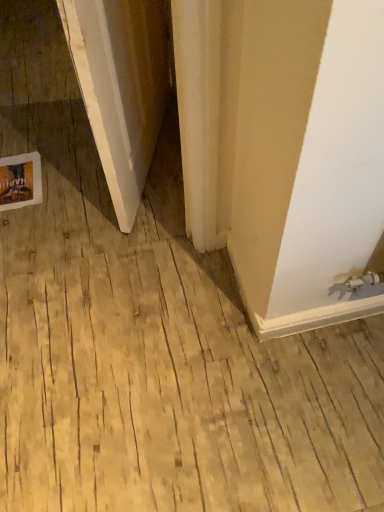
Question: Should I look upward or downward to see white cardboard postcard at lower left?

Choices:
 (A) up
 (B) down

Answer: (A)